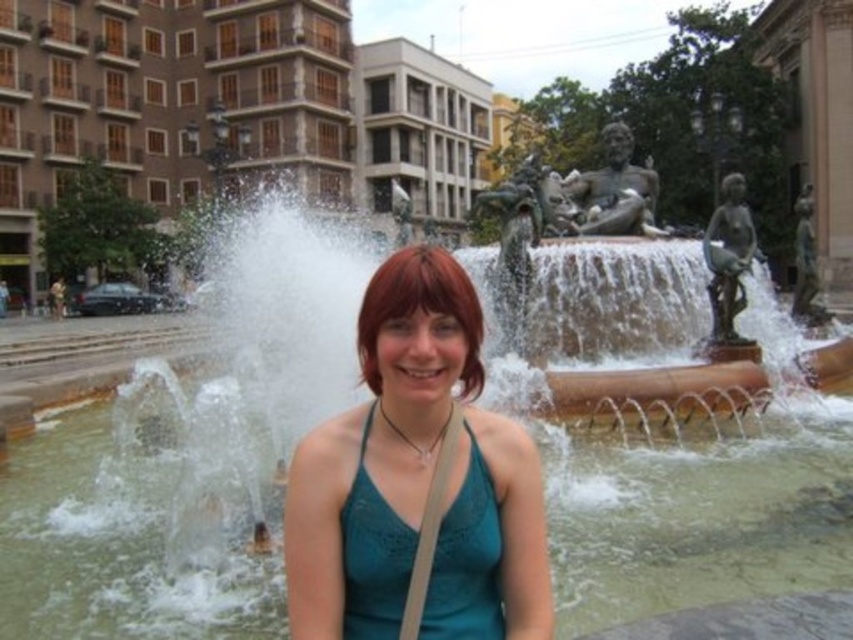
Question: Is clear water at center further to camera compared to teal fabric tank top at center?

Choices:
 (A) yes
 (B) no

Answer: (A)

Question: Does clear water at center have a greater width compared to teal fabric tank top at center?

Choices:
 (A) yes
 (B) no

Answer: (A)

Question: Is clear water at center positioned at the back of teal fabric tank top at center?

Choices:
 (A) yes
 (B) no

Answer: (A)

Question: Among these objects, which one is nearest to the camera?

Choices:
 (A) clear water at center
 (B) teal fabric tank top at center

Answer: (B)

Question: Among these points, which one is nearest to the camera?

Choices:
 (A) (103, 618)
 (B) (361, 460)

Answer: (B)